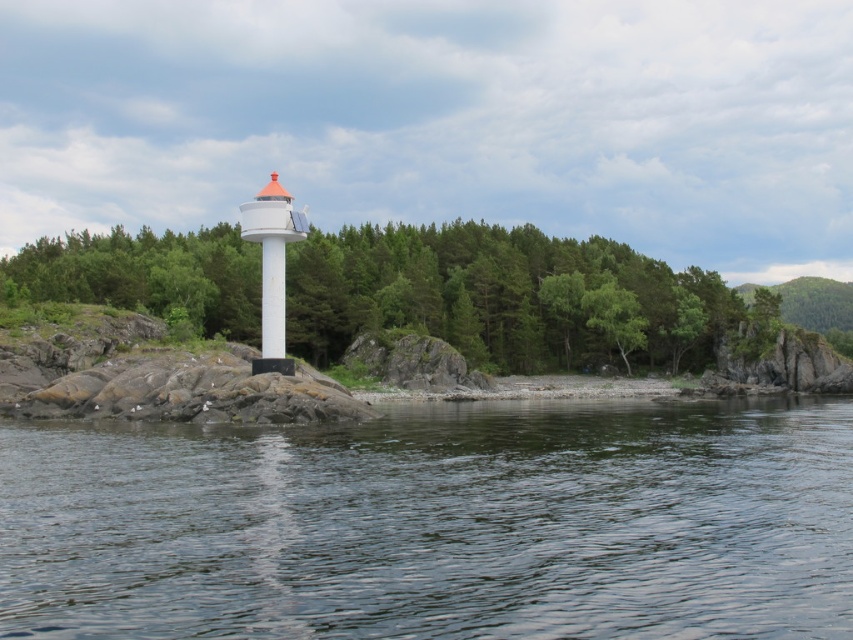
Question: Which of the following is the closest to the observer?

Choices:
 (A) green matte tree at center
 (B) transparent water at center

Answer: (B)

Question: Does transparent water at center appear under green leafy tree at center?

Choices:
 (A) no
 (B) yes

Answer: (B)

Question: Which object appears closest to the camera in this image?

Choices:
 (A) green matte tree at center
 (B) green leafy tree at center
 (C) transparent water at center

Answer: (C)

Question: Which object is positioned closest to the green leafy tree at center?

Choices:
 (A) green matte tree at center
 (B) transparent water at center

Answer: (A)

Question: Is the position of transparent water at center less distant than that of green matte tree at center?

Choices:
 (A) no
 (B) yes

Answer: (B)

Question: Can you confirm if transparent water at center is wider than green matte tree at center?

Choices:
 (A) no
 (B) yes

Answer: (A)